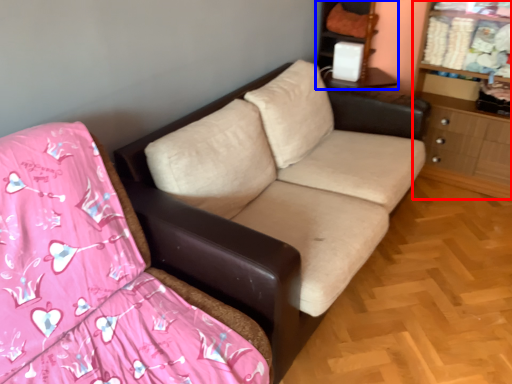
Question: Which of the following is the farthest to the observer, dresser (highlighted by a red box) or entertainment center (highlighted by a blue box)?

Choices:
 (A) dresser
 (B) entertainment center

Answer: (B)